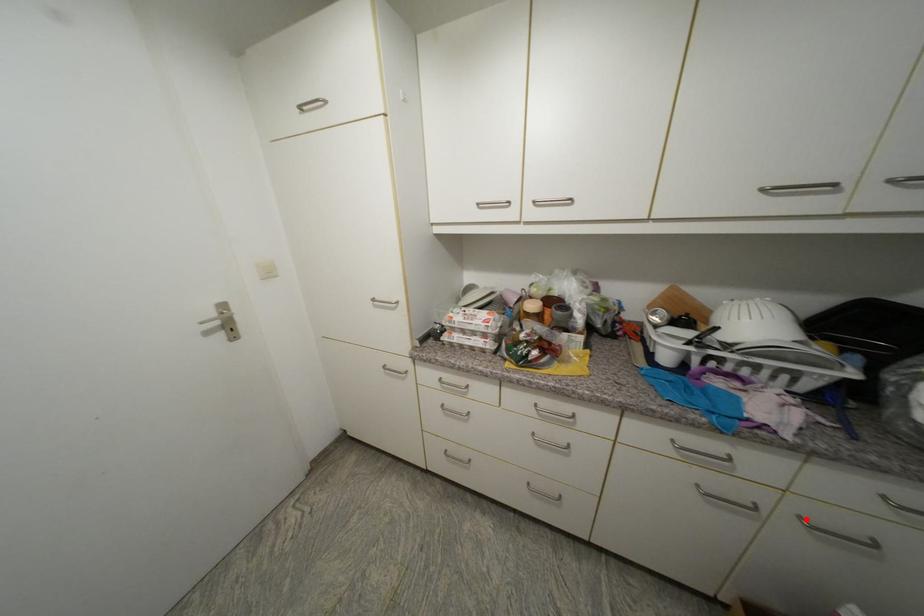
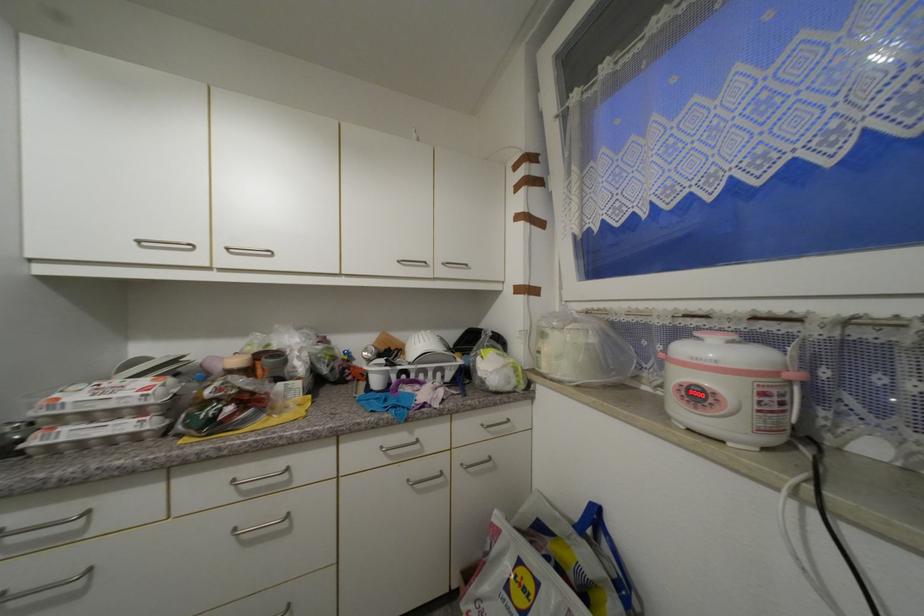
Where in the second image is the point corresponding to the highlighted location from the first image?

(468, 467)